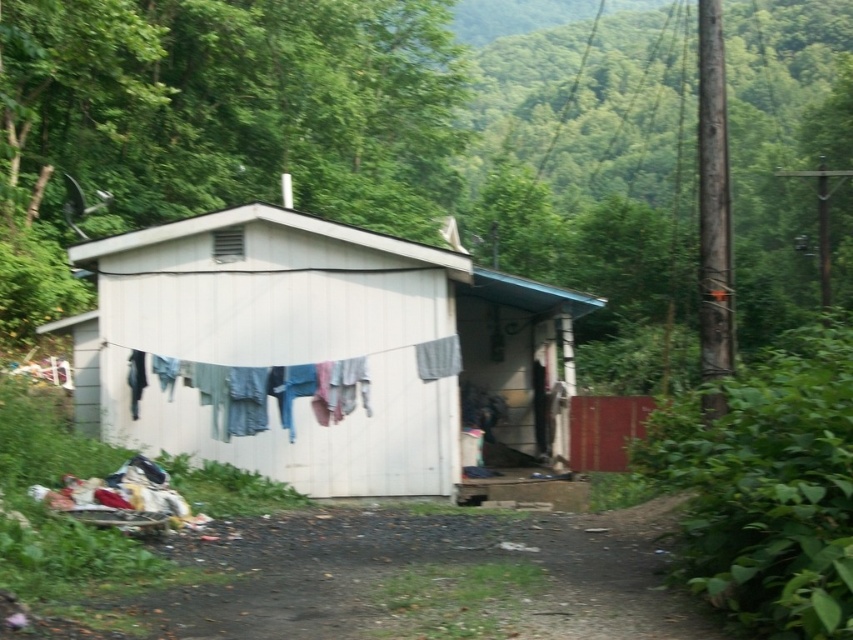
You are standing in front of the white corrugated metal hut at center and the washed cotton clothes at center. Which object is closer to you?

The washed cotton clothes at center are closer to you because the white corrugated metal hut at center is further away.